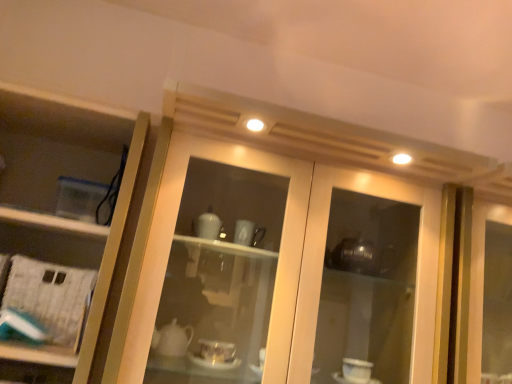
The height and width of the screenshot is (384, 512). What do you see at coordinates (285, 255) in the screenshot? I see `matte glass cabinet at center` at bounding box center [285, 255].

The image size is (512, 384). I want to click on matte glass cabinet at center, so click(285, 255).

Does point (67, 147) come farther from viewer compared to point (436, 291)?

Yes, it is behind point (436, 291).

From a real-world perspective, which object stands above the other?

matte glass cabinet at center.

Does clear plastic container at left have a greater height compared to matte glass cabinet at center?

Incorrect, the height of clear plastic container at left is not larger of that of matte glass cabinet at center.

Looking at this image, how many degrees apart are the facing directions of clear plastic container at left and matte glass cabinet at center?

The facing directions of clear plastic container at left and matte glass cabinet at center are 3.87e-05 degrees apart.

Do you think clear plastic container at left is within white paper at left, or outside of it?

The correct answer is: outside.

Between clear plastic container at left and white paper at left, which one has smaller width?

Thinner between the two is white paper at left.

From a real-world perspective, is clear plastic container at left under white paper at left?

No.

Considering the positions of points (26, 306) and (161, 251), is point (26, 306) closer to camera compared to point (161, 251)?

No, it is not.

Would you say white paper at left is to the left or to the right of matte glass cabinet at center in the picture?

Based on their positions, white paper at left is located to the left of matte glass cabinet at center.

Is white paper at left taller than matte glass cabinet at center?

No, white paper at left is not taller than matte glass cabinet at center.

Is white paper at left directly adjacent to matte glass cabinet at center?

No, white paper at left is not beside matte glass cabinet at center.

Which object is closer to the camera taking this photo, matte glass cabinet at center or white paper at left?

matte glass cabinet at center is closer to the camera.

From a real-world perspective, is matte glass cabinet at center under white paper at left?

Incorrect, from a real-world perspective, matte glass cabinet at center is higher than white paper at left.

Is matte glass cabinet at center oriented away from white paper at left?

matte glass cabinet at center does not have its back to white paper at left.

Is matte glass cabinet at center positioned far away from white paper at left?

matte glass cabinet at center is near white paper at left, not far away.

Consider the image. Could you tell me if white paper at left is facing clear plastic container at left?

Yes, white paper at left faces towards clear plastic container at left.

Between white paper at left and clear plastic container at left, which one is positioned in front?

clear plastic container at left.

How many degrees apart are the facing directions of white paper at left and clear plastic container at left?

4.62 degrees separate the facing orientations of white paper at left and clear plastic container at left.

Looking at their sizes, would you say white paper at left is wider or thinner than clear plastic container at left?

In the image, white paper at left appears to be more narrow than clear plastic container at left.

Is matte glass cabinet at center bigger than clear plastic container at left?

Correct, matte glass cabinet at center is larger in size than clear plastic container at left.

From a real-world perspective, does matte glass cabinet at center sit lower than clear plastic container at left?

No, from a real-world perspective, matte glass cabinet at center is not under clear plastic container at left.

Looking at their sizes, would you say matte glass cabinet at center is wider or thinner than clear plastic container at left?

matte glass cabinet at center is wider than clear plastic container at left.

Is matte glass cabinet at center inside the boundaries of clear plastic container at left, or outside?

matte glass cabinet at center is outside clear plastic container at left.

Locate an element on the screen. The height and width of the screenshot is (384, 512). cupboard below the matte glass cabinet at center (from a real-world perspective) is located at coordinates [x=56, y=189].

Locate an element on the screen. The height and width of the screenshot is (384, 512). shelf below the clear plastic container at left (from the image's perspective) is located at coordinates (49, 284).

Looking at the image, which one is located further to clear plastic container at left, white paper at left or matte glass cabinet at center?

matte glass cabinet at center is further to clear plastic container at left.

Estimate the real-world distances between objects in this image. Which object is further from matte glass cabinet at center, white paper at left or clear plastic container at left?

white paper at left is further to matte glass cabinet at center.

Based on their spatial positions, is matte glass cabinet at center or white paper at left closer to clear plastic container at left?

white paper at left is positioned closer to the anchor clear plastic container at left.

Considering their positions, is clear plastic container at left positioned further to white paper at left than matte glass cabinet at center?

Based on the image, matte glass cabinet at center appears to be further to white paper at left.

Looking at the image, which one is located closer to matte glass cabinet at center, clear plastic container at left or white paper at left?

Among the two, clear plastic container at left is located nearer to matte glass cabinet at center.

Based on their spatial positions, is matte glass cabinet at center or clear plastic container at left further from white paper at left?

Among the two, matte glass cabinet at center is located further to white paper at left.

Find the location of `shelf between clear plastic container at left and matte glass cabinet at center in the horizontal direction`. shelf between clear plastic container at left and matte glass cabinet at center in the horizontal direction is located at coordinates (49, 284).